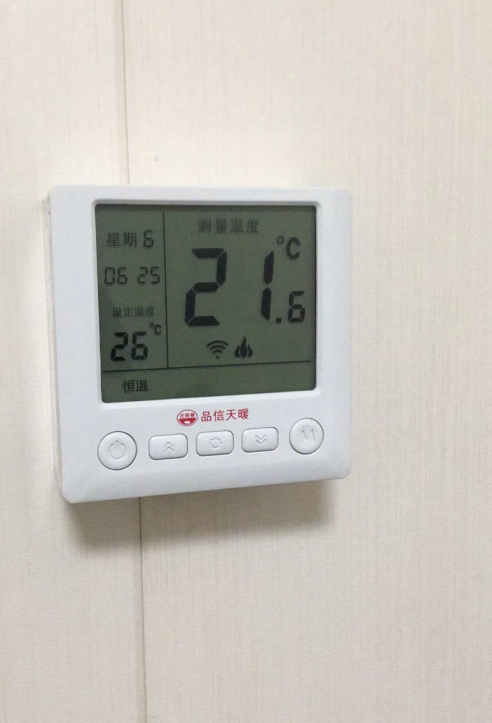
Identify the location of thermostat. (x=74, y=372).